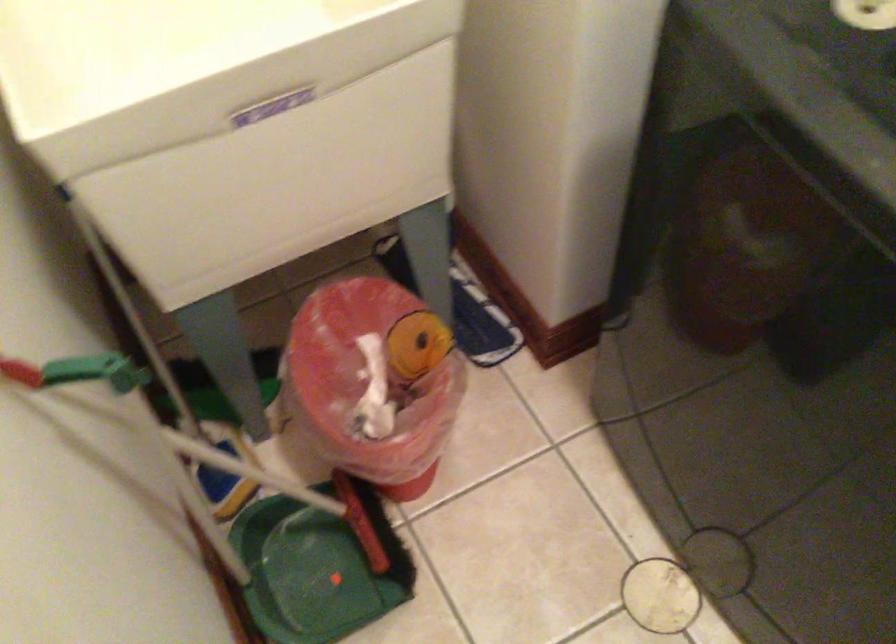
This screenshot has width=896, height=644. What do you see at coordinates (202, 485) in the screenshot?
I see `the green dustpan handle` at bounding box center [202, 485].